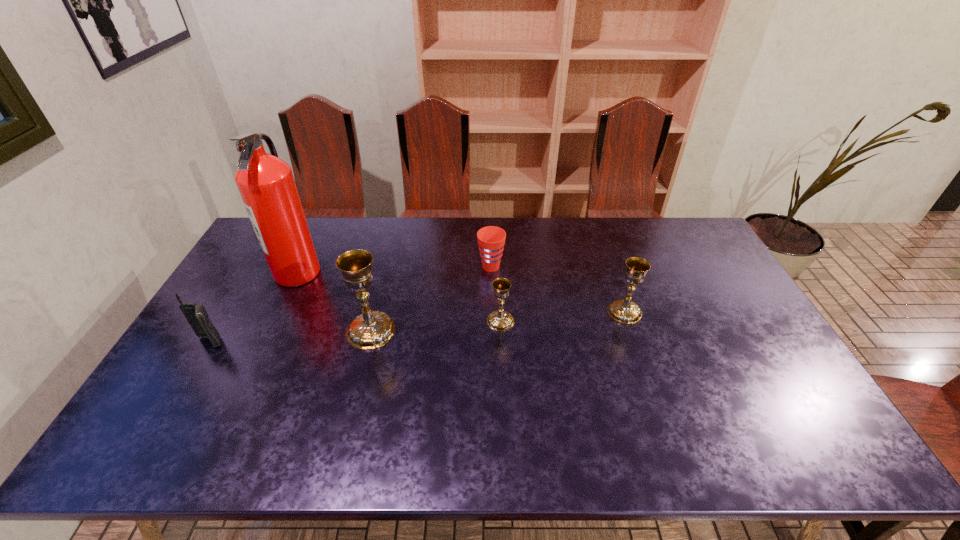
At what (x,y) coordinates should I click in order to perform the action: click on the second tallest object. Please return your answer as a coordinate pair (x, y). This screenshot has width=960, height=540. Looking at the image, I should click on (371, 329).

Identify the location of the tallest chalice. The height and width of the screenshot is (540, 960). (371, 329).

This screenshot has height=540, width=960. What are the coordinates of `the second chalice from left to right` in the screenshot? It's located at (500, 320).

This screenshot has width=960, height=540. I want to click on the rightmost chalice, so click(624, 311).

This screenshot has width=960, height=540. Identify the location of the rightmost object. (624, 311).

This screenshot has height=540, width=960. I want to click on fire extinguisher, so (x=266, y=184).

You are a GUI agent. You are given a task and a screenshot of the screen. Output one action in this format:
    pyautogui.click(x=<x>, y=<y>)
    Task: Click on the tallest object
    The image size is (960, 540).
    Given the screenshot: What is the action you would take?
    pyautogui.click(x=266, y=184)

This screenshot has width=960, height=540. What are the coordinates of `cup` in the screenshot? It's located at (491, 239).

What are the coordinates of `cellular telephone` in the screenshot? It's located at (196, 315).

Find the location of a particular element. The height and width of the screenshot is (540, 960). vacant area situated 0.250m on the back of the tallest chalice is located at coordinates (388, 261).